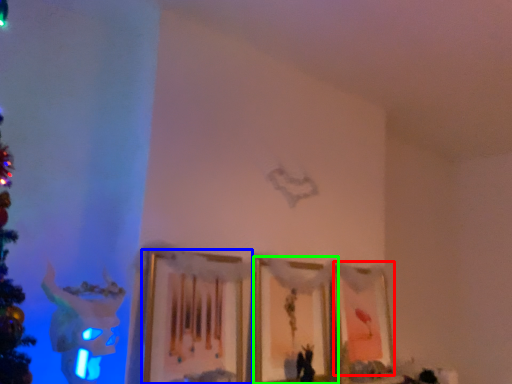
Question: Which object is the closest to the picture frame (highlighted by a red box)? Choose among these: picture frame (highlighted by a blue box) or picture frame (highlighted by a green box).

Choices:
 (A) picture frame
 (B) picture frame

Answer: (B)